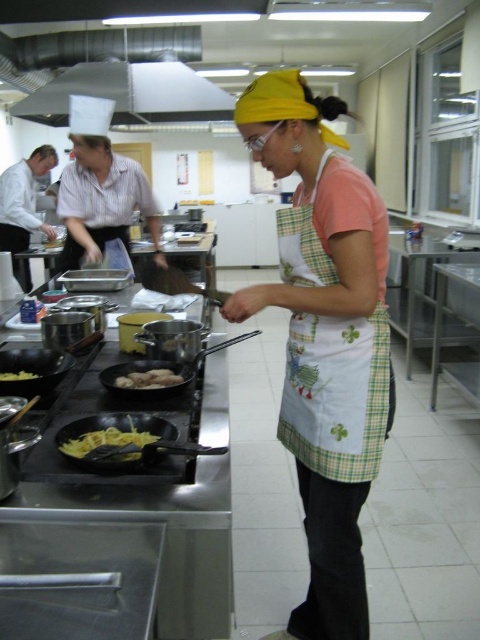
You are a chef in this kitchen. You need to place a new ingredient on the counter between the green checkered apron at center and the yellow matte food at lower left. Where should you place it to ensure it is closer to the taller object?

The green checkered apron at center is much taller than the yellow matte food at lower left, so placing the ingredient closer to the green checkered apron at center would ensure it is nearer to the taller object.

You are a chef trying to decide where to place a new ingredient container. The container is wider than the matte black frying pan at lower left. Can it fit in the space currently occupied by the green checkered apron at center?

The green checkered apron at center is wider than the matte black frying pan at lower left. Since the container is wider than the frying pan, it may not fit in the space occupied by the apron unless there is additional room available.